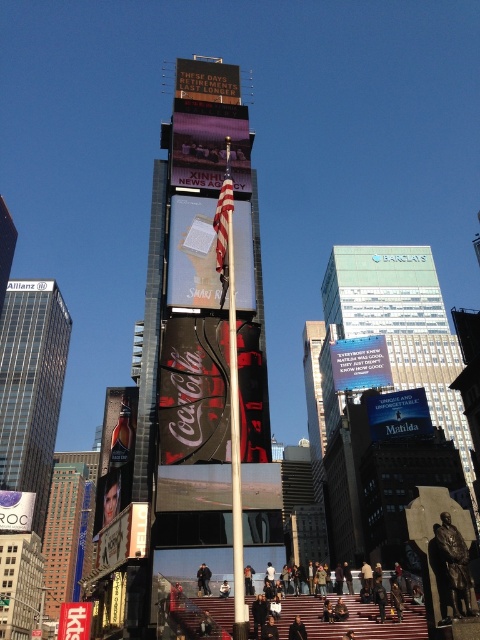
Question: Does matte white sign at center appear on the right side of red fabric sign at center?

Choices:
 (A) yes
 (B) no

Answer: (B)

Question: Among these objects, which one is farthest from the camera?

Choices:
 (A) green glass skyscraper at center
 (B) red fabric sign at center
 (C) blue fabric matilda at center

Answer: (A)

Question: Among these objects, which one is farthest from the camera?

Choices:
 (A) red brick stairs at center
 (B) black digital screen at upper center

Answer: (B)

Question: Is glassy skyscraper at left to the right of white paper at center from the viewer's perspective?

Choices:
 (A) yes
 (B) no

Answer: (B)

Question: Is metallic coca-cola sign at center to the right of red brick stairs at center from the viewer's perspective?

Choices:
 (A) yes
 (B) no

Answer: (B)

Question: Which point is farther to the camera?

Choices:
 (A) blue fabric matilda at center
 (B) red brick stairs at center
 (C) red fabric sign at center
 (D) matte purple screen at center

Answer: (A)